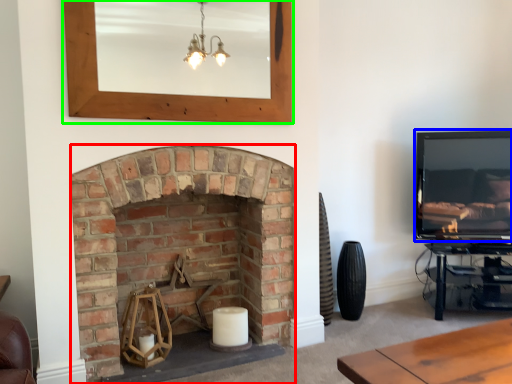
Question: Which object is positioned farthest from fireplace (highlighted by a red box)? Select from television (highlighted by a blue box) and picture frame (highlighted by a green box).

Choices:
 (A) television
 (B) picture frame

Answer: (A)